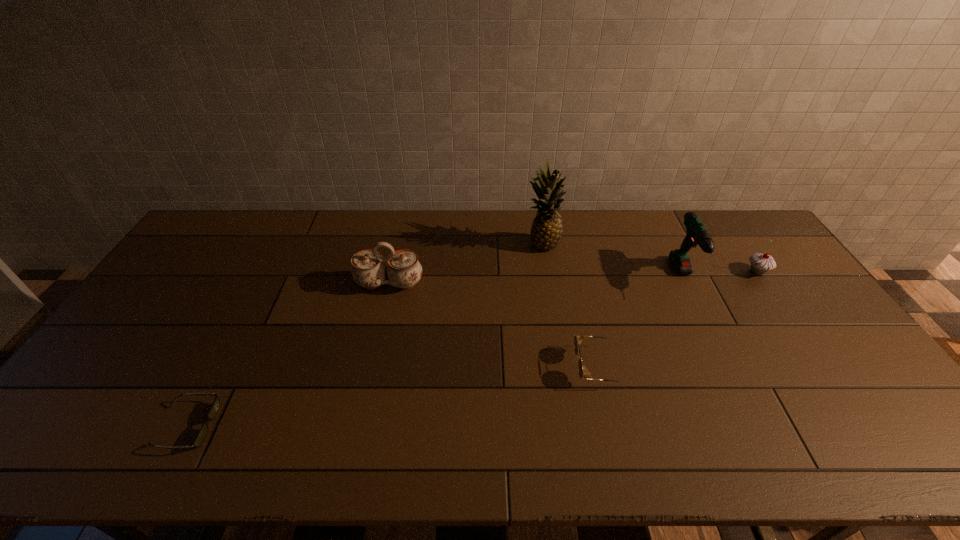
Image resolution: width=960 pixels, height=540 pixels. What are the coordinates of `the nearest object` in the screenshot? It's located at (202, 433).

Where is `blank space located 0.380m on the front of the tallest object`? This screenshot has height=540, width=960. blank space located 0.380m on the front of the tallest object is located at coordinates (558, 345).

Find the location of a particular element. vacant space located 0.310m on the handle side of the fifth shortest object is located at coordinates (742, 392).

Where is `vacant area located 0.250m by the handle of the chinaware`? vacant area located 0.250m by the handle of the chinaware is located at coordinates (372, 362).

Where is `blank space located 0.320m on the left of the fourth tallest object`? blank space located 0.320m on the left of the fourth tallest object is located at coordinates (648, 272).

In order to click on vacant space situated 0.260m on the front lenses of the taller sunglasses in this screenshot , I will do `click(478, 367)`.

Locate an element on the screen. vacant space situated 0.330m on the front lenses of the taller sunglasses is located at coordinates (452, 367).

Find the location of a particular element. This screenshot has width=960, height=540. free location located 0.120m on the front lenses of the taller sunglasses is located at coordinates (x=531, y=367).

Image resolution: width=960 pixels, height=540 pixels. I want to click on free space located 0.200m on the front-facing side of the nearer sunglasses, so click(297, 426).

Identify the location of object at the far edge. Image resolution: width=960 pixels, height=540 pixels. (546, 231).